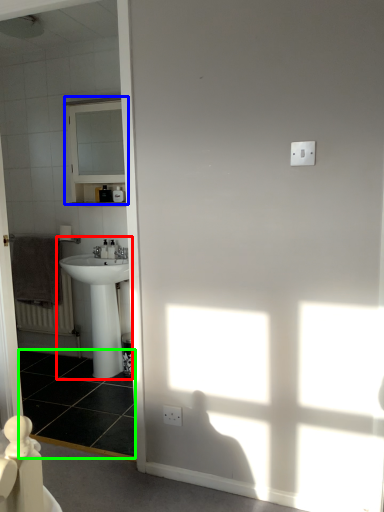
Question: Which is farther away from sink (highlighted by a red box)? medicine cabinet (highlighted by a blue box) or tile (highlighted by a green box)?

Choices:
 (A) medicine cabinet
 (B) tile

Answer: (A)